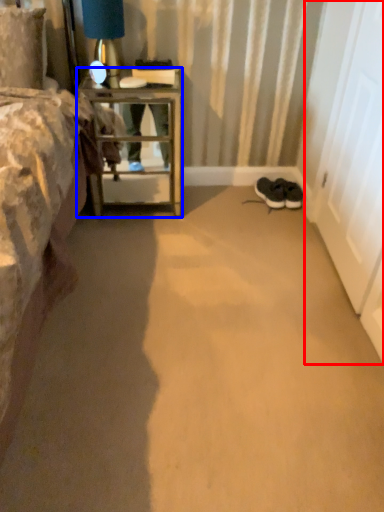
Question: Which of the following is the farthest to the observer, screen door (highlighted by a red box) or nightstand (highlighted by a blue box)?

Choices:
 (A) screen door
 (B) nightstand

Answer: (B)